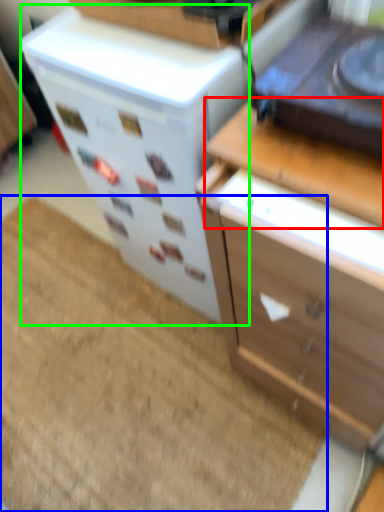
Question: Which object is the farthest from counter top (highlighted by a red box)? Choose among these: doormat (highlighted by a blue box) or appliance (highlighted by a green box).

Choices:
 (A) doormat
 (B) appliance

Answer: (A)